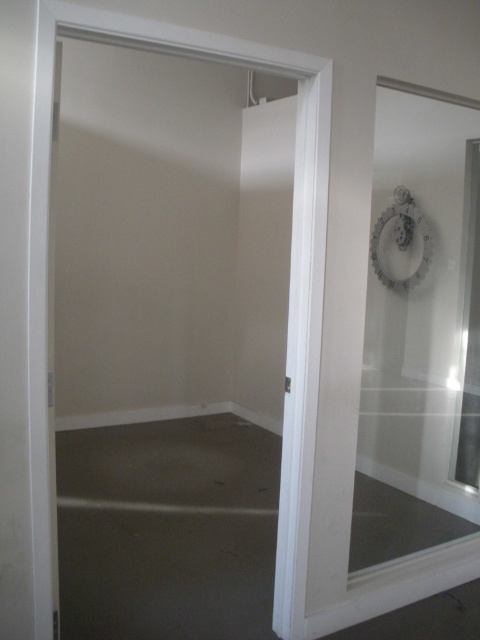
You are a delivery person holding a large package that is 8 feet long. You need to bring it through the transparent glass door at center. Can you fit the package through the door without bending or breaking it?

The transparent glass door at center is 7.19 feet away from the camera. Since the package is 8 feet long, which is longer than the distance available, it won not fit through the door without bending or breaking.

You are a delivery person trying to enter the room through the door. You see a white matte door at center and a transparent glass door at center. Which door should you go through to enter the room?

The white matte door at center is to the left of the transparent glass door at center. Since the room is empty and under construction, the transparent glass door at center is likely the correct entrance as it allows visibility, making it easier to navigate safely into the empty space.